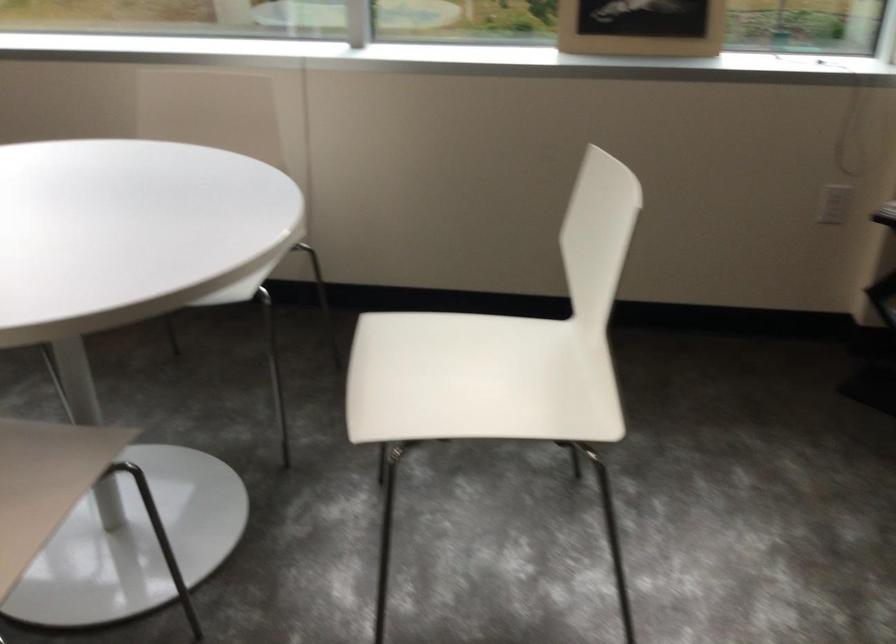
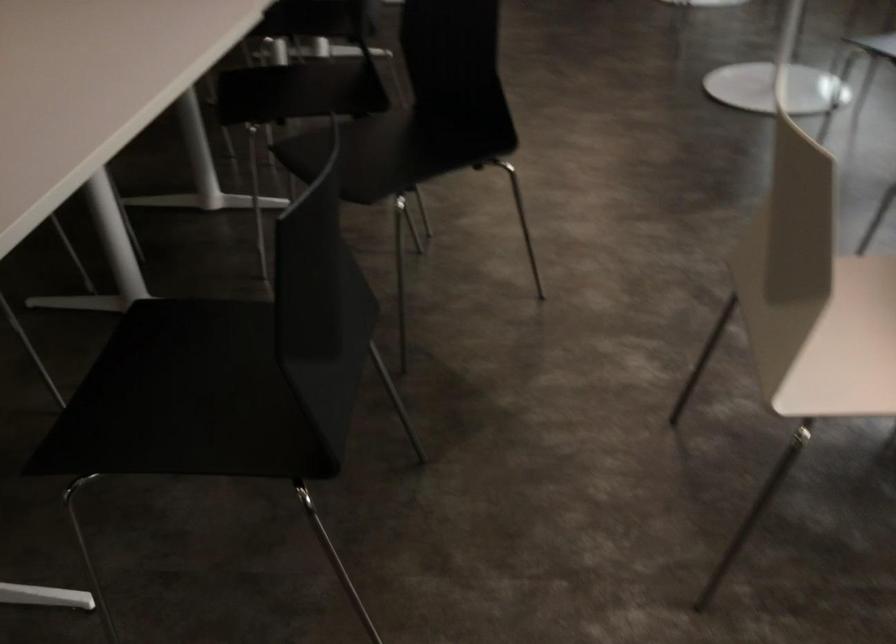
The first image is from the beginning of the video and the second image is from the end. How did the camera likely rotate when shooting the video?

The rotation direction of the camera is left-down.